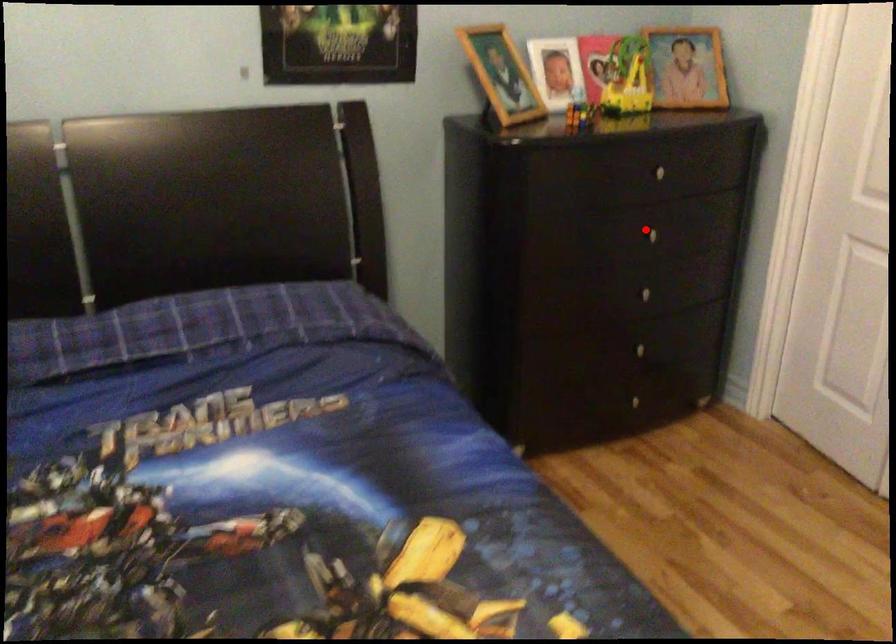
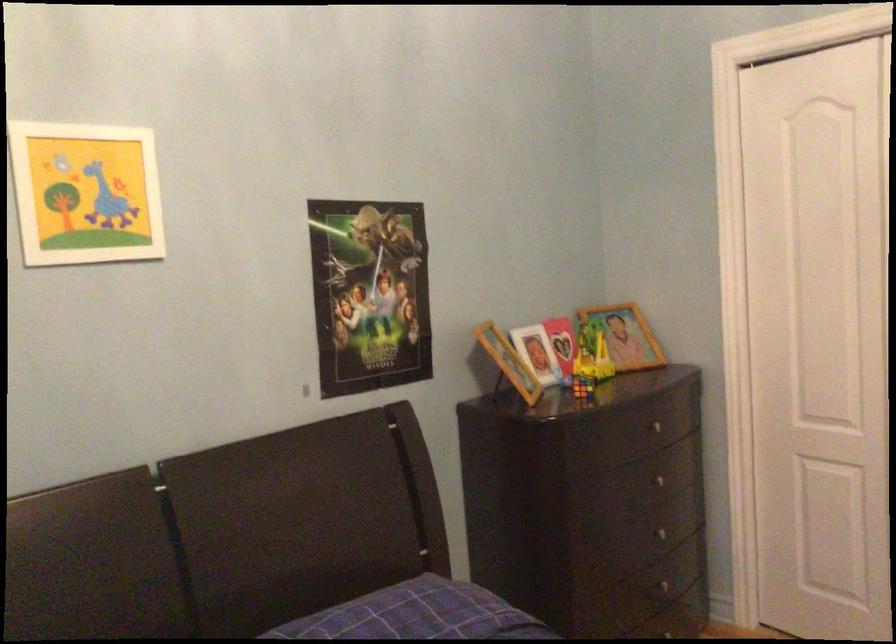
Question: I am providing you with two images of the same scene from different viewpoints. In image1, a red point is highlighted. Considering the same 3D point in image2, which of the following is correct?

Choices:
 (A) It is closer
 (B) It is farther

Answer: (B)